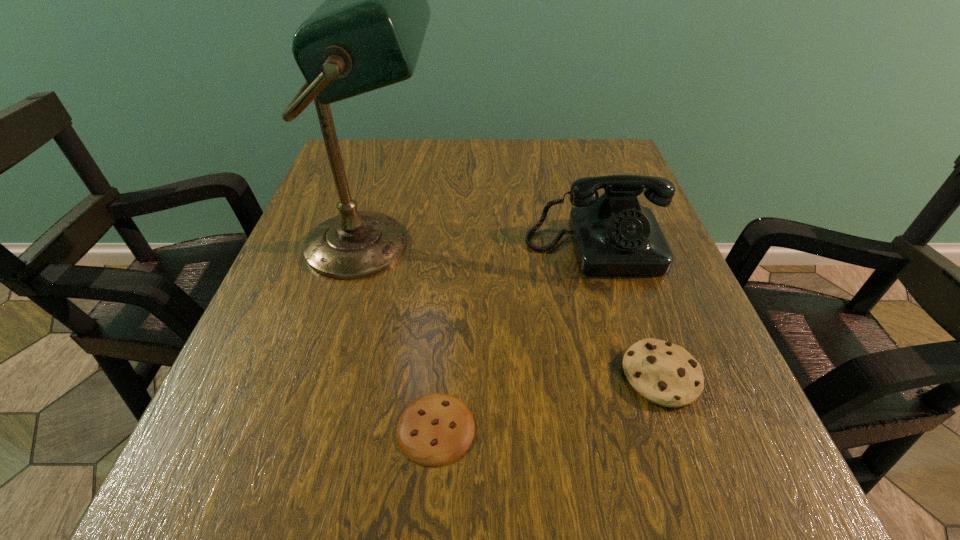
Find the location of a particular element. Image resolution: width=960 pixels, height=540 pixels. free region at the near right corner is located at coordinates (723, 476).

This screenshot has height=540, width=960. What are the coordinates of `vacant region between the table lamp and the left cookie` in the screenshot? It's located at (404, 336).

I want to click on free space between the telephone and the shortest object, so click(516, 337).

This screenshot has height=540, width=960. I want to click on vacant area between the telephone and the left cookie, so click(516, 337).

The image size is (960, 540). Find the location of `free spot between the tallest object and the right cookie`. free spot between the tallest object and the right cookie is located at coordinates (516, 310).

Locate an element on the screen. free space that is in between the tallest object and the second tallest object is located at coordinates (484, 245).

Identify the location of unoccupied area between the second shortest object and the left cookie. (548, 402).

The image size is (960, 540). In order to click on free area in between the shortest object and the taller cookie in this screenshot , I will do `click(548, 402)`.

Find the location of a particular element. unoccupied area between the taller cookie and the third shortest object is located at coordinates (628, 310).

The height and width of the screenshot is (540, 960). Find the location of `free spot between the left cookie and the taller cookie`. free spot between the left cookie and the taller cookie is located at coordinates (548, 402).